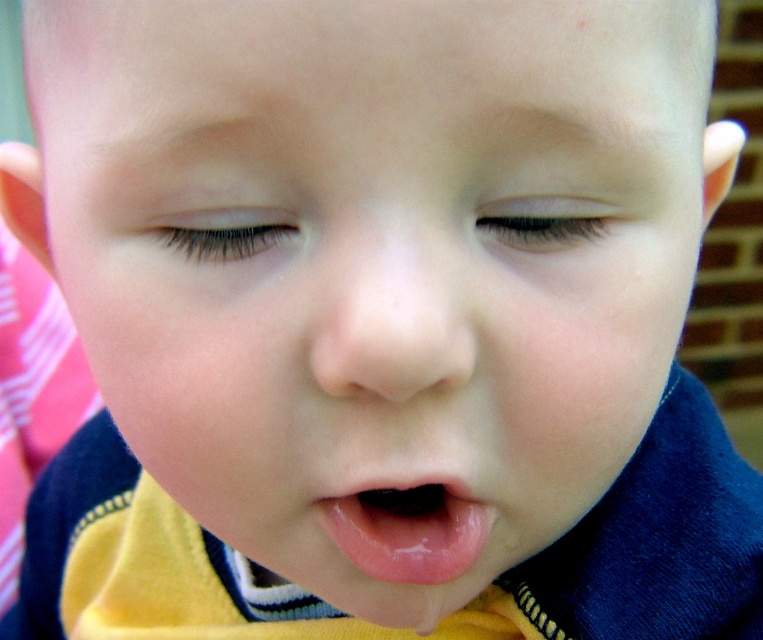
Question: Which object is farther from the camera taking this photo?

Choices:
 (A) black eyelashes at upper center
 (B) glossy pink lips at center
 (C) smooth skin eye at center
 (D) smooth flesh-colored nose at center

Answer: (B)

Question: Can you confirm if smooth skin eye at center is bigger than black eyelashes at upper center?

Choices:
 (A) yes
 (B) no

Answer: (B)

Question: Is smooth flesh-colored nose at center to the right of glossy pink lips at center from the viewer's perspective?

Choices:
 (A) no
 (B) yes

Answer: (A)

Question: Which is nearer to the smooth flesh-colored nose at center?

Choices:
 (A) black eyelashes at upper center
 (B) smooth skin eye at center
 (C) glossy pink lips at center

Answer: (B)

Question: Does glossy pink lips at center appear on the right side of black eyelashes at upper center?

Choices:
 (A) yes
 (B) no

Answer: (A)

Question: Estimate the real-world distances between objects in this image. Which object is farther from the smooth flesh-colored nose at center?

Choices:
 (A) smooth skin eye at center
 (B) black eyelashes at upper center
 (C) glossy pink lips at center

Answer: (C)